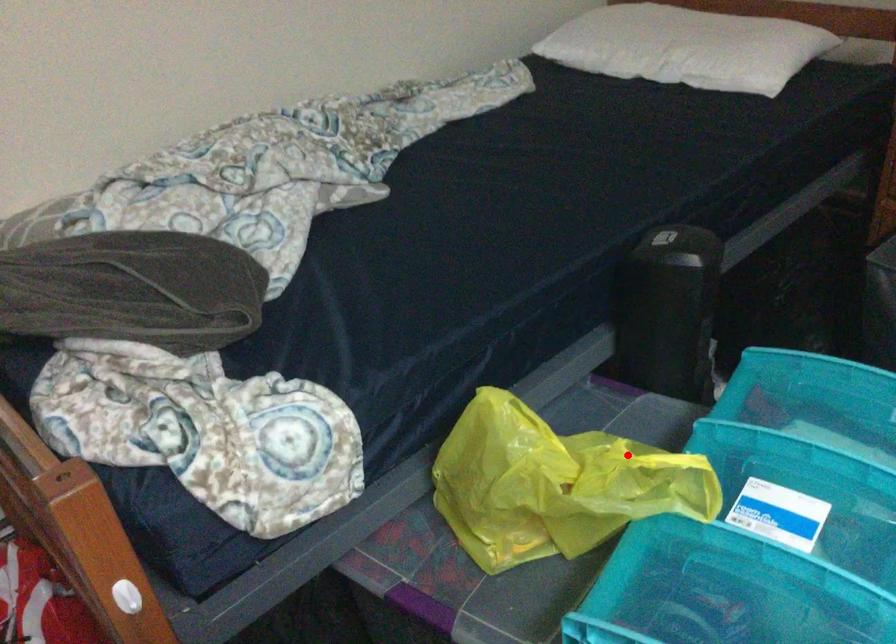
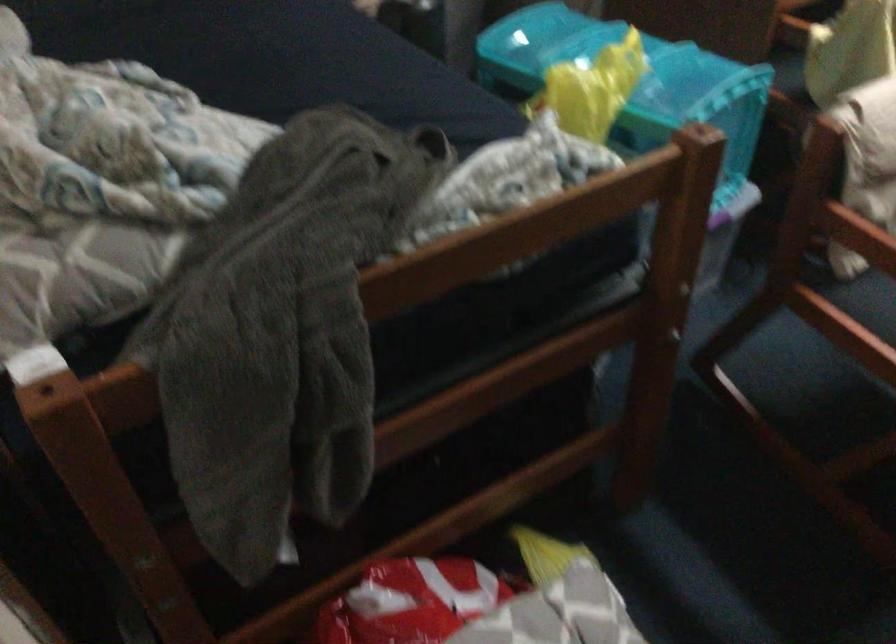
Question: I am providing you with two images of the same scene from different viewpoints. In image1, a red point is highlighted. Considering the same 3D point in image2, which of the following is correct?

Choices:
 (A) It is closer
 (B) It is farther

Answer: (B)